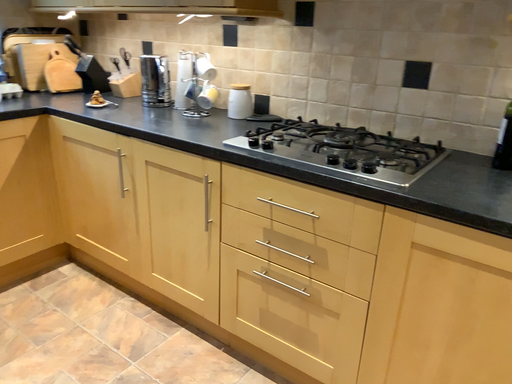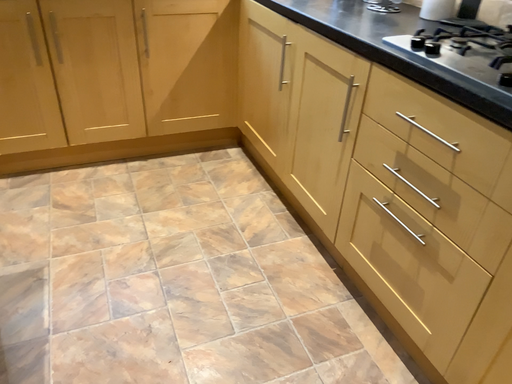
Question: How did the camera likely rotate when shooting the video?

Choices:
 (A) rotated upward
 (B) rotated downward

Answer: (B)